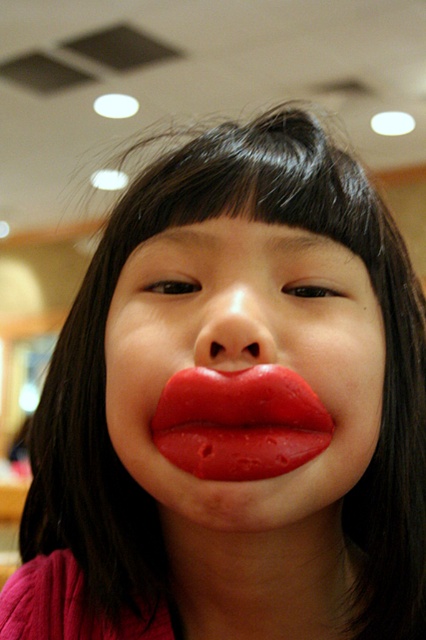
Question: Which of the following is the farthest from the observer?

Choices:
 (A) (210, 422)
 (B) (210, 348)
 (C) (186, 310)

Answer: (C)

Question: Observing the image, what is the correct spatial positioning of shiny red lips at center in reference to smooth skin nose at center?

Choices:
 (A) above
 (B) below

Answer: (B)

Question: Among these objects, which one is nearest to the camera?

Choices:
 (A) shiny red lips at center
 (B) smooth skin nose at center
 (C) glossy red lips at center

Answer: (A)

Question: Is shiny red lips at center to the right of smooth skin nose at center from the viewer's perspective?

Choices:
 (A) no
 (B) yes

Answer: (B)

Question: Does shiny red lips at center have a larger size compared to glossy red lips at center?

Choices:
 (A) yes
 (B) no

Answer: (A)

Question: Among these points, which one is farthest from the camera?

Choices:
 (A) (232, 218)
 (B) (299, 432)

Answer: (A)